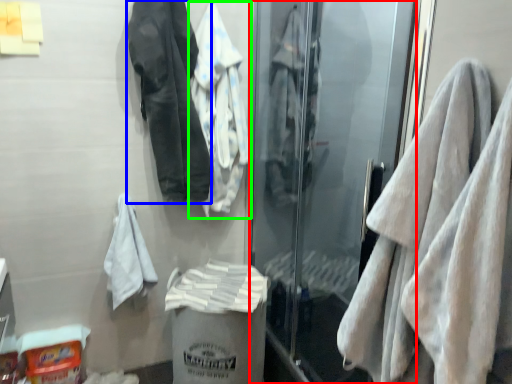
Question: Which object is positioned closest to screen door (highlighted by a red box)? Select from jacket (highlighted by a blue box) and jacket (highlighted by a green box).

Choices:
 (A) jacket
 (B) jacket

Answer: (B)